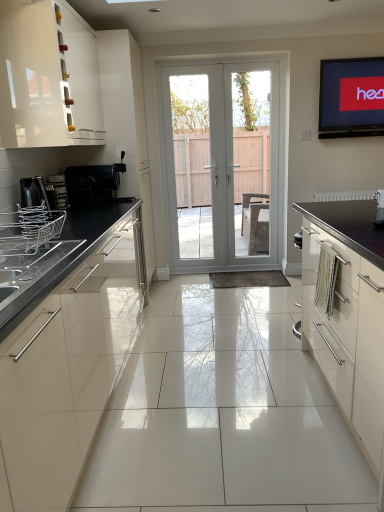
Question: Considering the positions of white glossy door at center and white glossy door at center, which is the 2th screen door in left-to-right order, in the image, is white glossy door at center taller or shorter than white glossy door at center, which is the 2th screen door in left-to-right order,?

Choices:
 (A) short
 (B) tall

Answer: (B)

Question: Is white glossy door at center to the left or to the right of white glossy door at center, which is the 2th screen door in left-to-right order, in the image?

Choices:
 (A) right
 (B) left

Answer: (B)

Question: Based on their relative distances, which object is nearer to the clear glass door at center, which ranks as the 2th screen door in right-to-left order?

Choices:
 (A) white glossy door at center, which is counted as the first screen door, starting from the right
 (B) matte black tv at upper right
 (C) white glossy cabinet at right, the second cabinetry positioned from the left
 (D) satin silver toaster at left, the 2th appliance viewed from the top
 (E) white glossy door at center

Answer: (E)

Question: Which object is positioned closest to the white glossy cabinet at upper left, which is the first cabinetry in top-to-bottom order?

Choices:
 (A) black matte coffee machine at left, placed as the third appliance when sorted from front to back
 (B) white glossy cabinet at right, the second cabinetry positioned from the left
 (C) white glossy door at center
 (D) satin silver toaster at left, the second appliance from the front
 (E) clear glass door at center, which ranks as the 2th screen door in right-to-left order

Answer: (D)